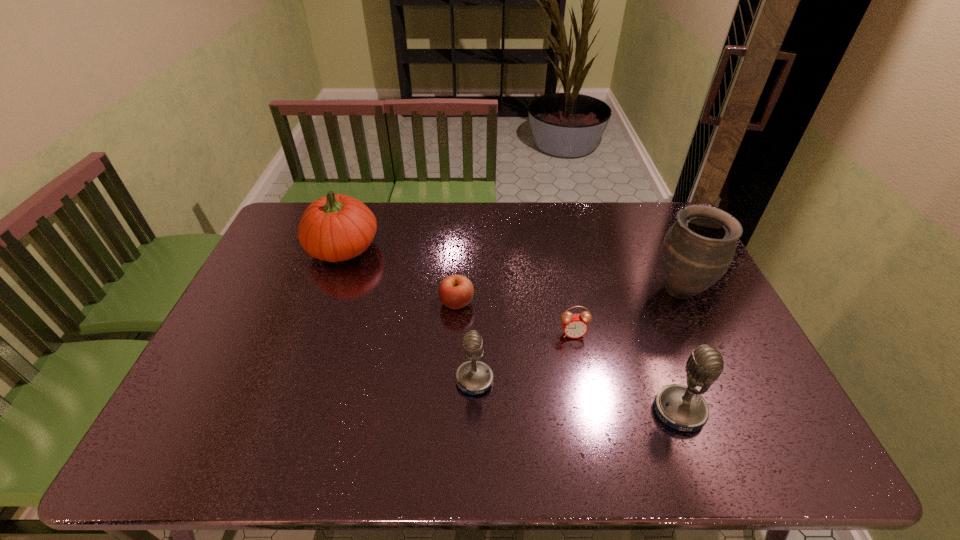
Find the location of a particular element. unoccupied area between the apple and the alarm clock is located at coordinates (515, 319).

The width and height of the screenshot is (960, 540). I want to click on vacant space in between the taller microphone and the left microphone, so click(x=577, y=396).

Find the location of a particular element. Image resolution: width=960 pixels, height=540 pixels. empty space between the right microphone and the pumpkin is located at coordinates (511, 329).

Find the location of `object that is the third closest to the urn`. object that is the third closest to the urn is located at coordinates (473, 377).

Identify which object is located as the fifth nearest to the left microphone. Please provide its 2D coordinates. Your answer should be formatted as a tuple, i.e. [(x, y)], where the tuple contains the x and y coordinates of a point satisfying the conditions above.

[(698, 249)]